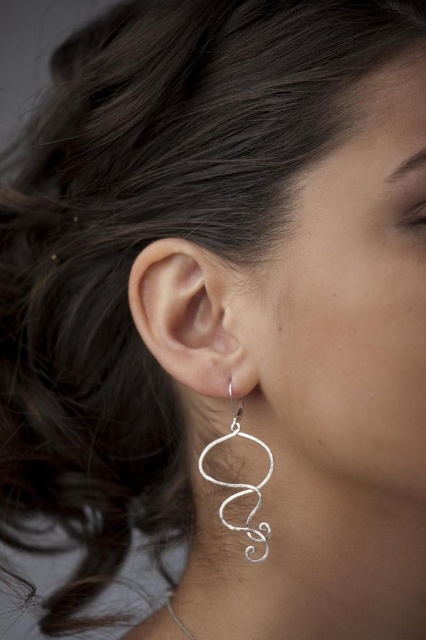
You are a jeweler examining a closeup of an ear with an earring. The earring has a point at coordinates (193, 317). What object is located at that coordinate?

The point at coordinates (193, 317) indicates the silver wire earring at center.

You are an artist trying to sketch the earring from the image. You need to determine the order of the earring parts to draw them correctly. Which point should you draw first, point (242, 308) or point (173, 618)?

Point (242, 308) should be drawn first because it is in front of point (173, 618).

You are a jeweler measuring the spacing between two silver wire pieces. You have a ruler and need to determine if there is enough space between the silver wire earring at lower left and the silver wire necklace at lower center to place a 15 cm chain between them. Can you confirm if the space is sufficient?

The distance between the silver wire earring at lower left and the silver wire necklace at lower center is 13.75 centimeters. Since the required space for the 15 cm chain is greater than the available distance, the chain cannot fit between them.